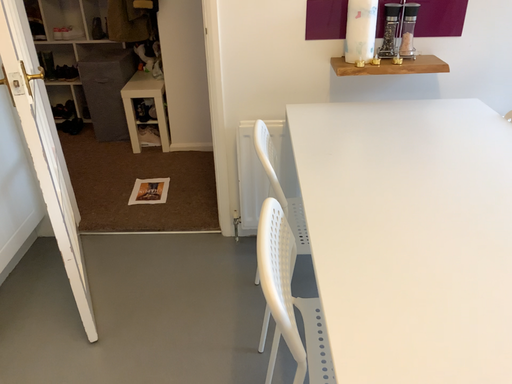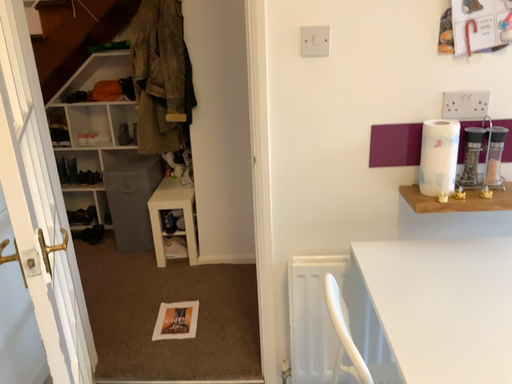
Question: Which way did the camera rotate in the video?

Choices:
 (A) rotated upward
 (B) rotated downward

Answer: (A)